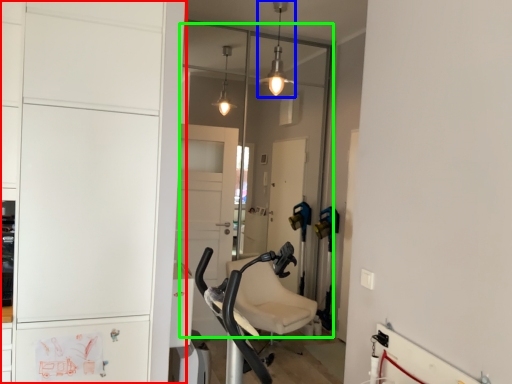
Question: Based on their relative distances, which object is nearer to cabinetry (highlighted by a red box)? Choose from light fixture (highlighted by a blue box) and glass door (highlighted by a green box).

Choices:
 (A) light fixture
 (B) glass door

Answer: (A)